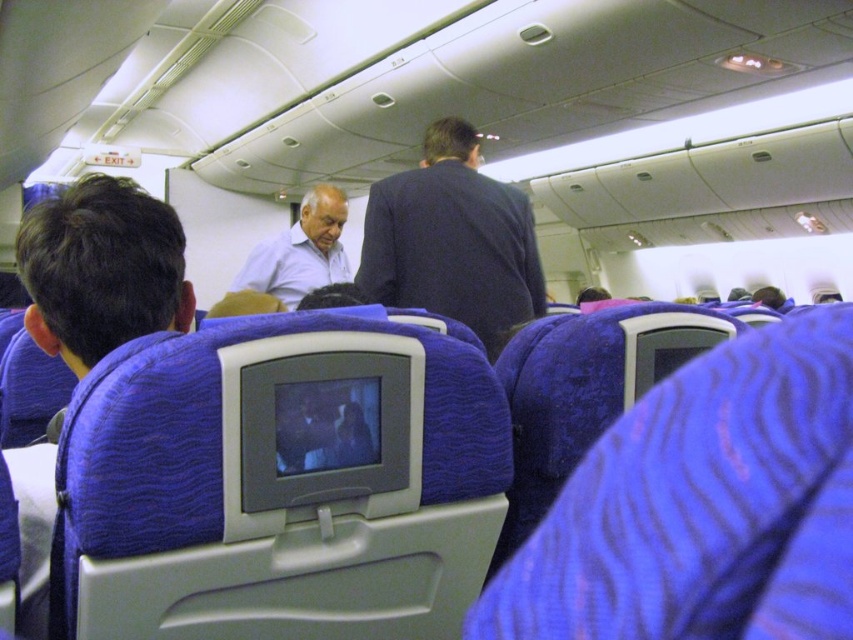
Question: Which object is positioned closest to the light blue shirt at center?

Choices:
 (A) dark blue suit at center
 (B) blue fabric shirt at left

Answer: (A)

Question: Estimate the real-world distances between objects in this image. Which object is farther from the light blue shirt at center?

Choices:
 (A) blue fabric shirt at left
 (B) dark blue suit at center

Answer: (A)

Question: Does dark blue suit at center appear under light blue shirt at center?

Choices:
 (A) no
 (B) yes

Answer: (B)

Question: Is dark blue suit at center behind light blue shirt at center?

Choices:
 (A) yes
 (B) no

Answer: (B)

Question: Is dark blue suit at center smaller than blue fabric shirt at left?

Choices:
 (A) no
 (B) yes

Answer: (A)

Question: Among these points, which one is nearest to the camera?

Choices:
 (A) (483, 244)
 (B) (318, 276)
 (C) (53, 220)

Answer: (C)